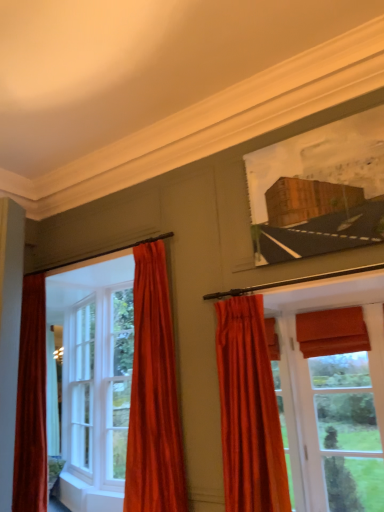
Question: Can you confirm if matte orange roman shade at right, which appears as the 2th window when viewed from the back, is thinner than wooden frame at upper right?

Choices:
 (A) yes
 (B) no

Answer: (A)

Question: Is matte orange roman shade at right, which ranks as the first window in right-to-left order, further to camera compared to wooden frame at upper right?

Choices:
 (A) yes
 (B) no

Answer: (A)

Question: From a real-world perspective, is matte orange roman shade at right, which appears as the 2th window when viewed from the back, beneath wooden frame at upper right?

Choices:
 (A) yes
 (B) no

Answer: (A)

Question: Is matte orange roman shade at right, placed as the 1th window when sorted from front to back, shorter than wooden frame at upper right?

Choices:
 (A) no
 (B) yes

Answer: (A)

Question: Is matte orange roman shade at right, the 2th window viewed from the left, wider than wooden frame at upper right?

Choices:
 (A) yes
 (B) no

Answer: (B)

Question: From the image's perspective, is matte orange roman shade at right, placed as the 1th window when sorted from front to back, over wooden frame at upper right?

Choices:
 (A) no
 (B) yes

Answer: (A)

Question: Can you confirm if velvet orange curtain at center, the first curtain positioned from the right, is bigger than velvet orange curtain at left, marked as the 1th curtain in a left-to-right arrangement?

Choices:
 (A) no
 (B) yes

Answer: (A)

Question: Is velvet orange curtain at center, the first curtain positioned from the right, further to camera compared to velvet orange curtain at left, the 2th curtain when ordered from right to left?

Choices:
 (A) yes
 (B) no

Answer: (B)

Question: Does velvet orange curtain at center, acting as the second curtain starting from the left, touch velvet orange curtain at left, marked as the 1th curtain in a left-to-right arrangement?

Choices:
 (A) yes
 (B) no

Answer: (B)

Question: Is velvet orange curtain at center, acting as the second curtain starting from the left, positioned with its back to velvet orange curtain at left, the 2th curtain when ordered from right to left?

Choices:
 (A) no
 (B) yes

Answer: (A)

Question: Could you tell me if velvet orange curtain at center, the first curtain positioned from the right, is turned towards velvet orange curtain at left, marked as the 1th curtain in a left-to-right arrangement?

Choices:
 (A) no
 (B) yes

Answer: (A)

Question: Is velvet orange curtain at center, the first curtain positioned from the right, positioned beyond the bounds of velvet orange curtain at left, the 2th curtain when ordered from right to left?

Choices:
 (A) yes
 (B) no

Answer: (A)

Question: From the image's perspective, is velvet orange curtain at left, the 2th curtain when ordered from right to left, above wooden frame at upper right?

Choices:
 (A) yes
 (B) no

Answer: (B)